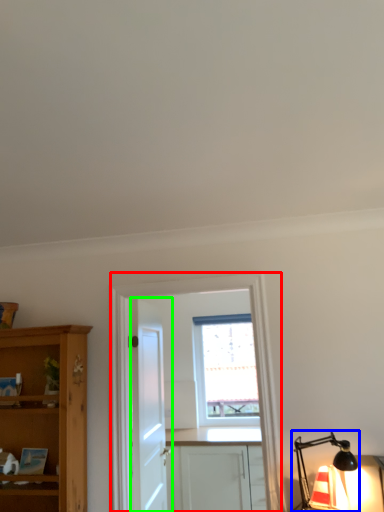
Question: Which is farther away from entertainment center (highlighted by a red box)? light fixture (highlighted by a blue box) or door (highlighted by a green box)?

Choices:
 (A) light fixture
 (B) door

Answer: (B)